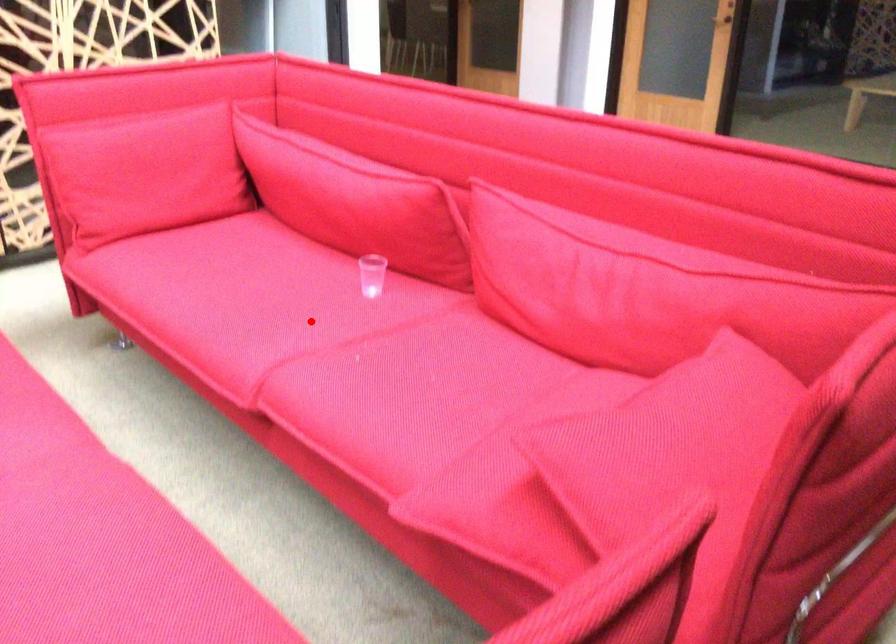
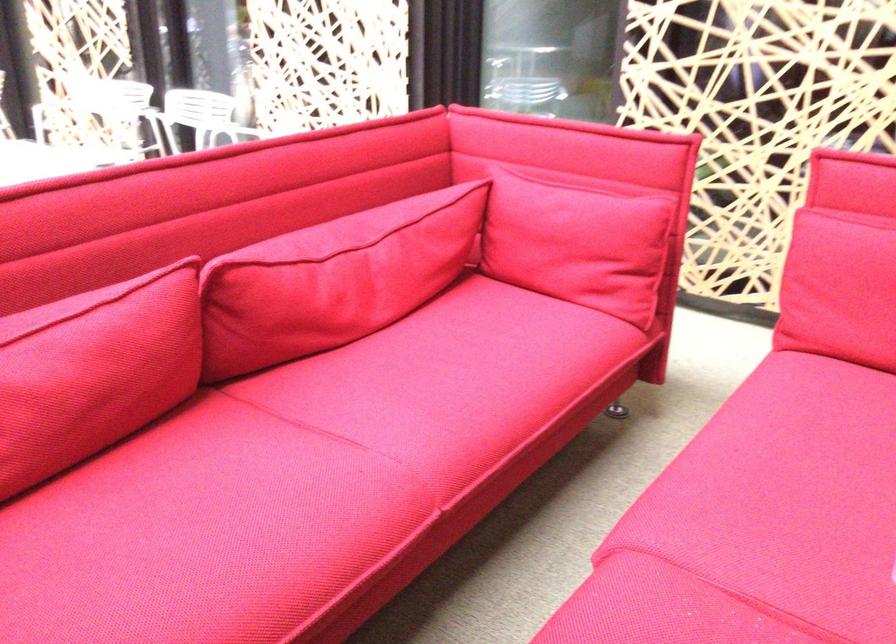
Locate, in the second image, the point that corresponds to the highlighted location in the first image.

(759, 522)